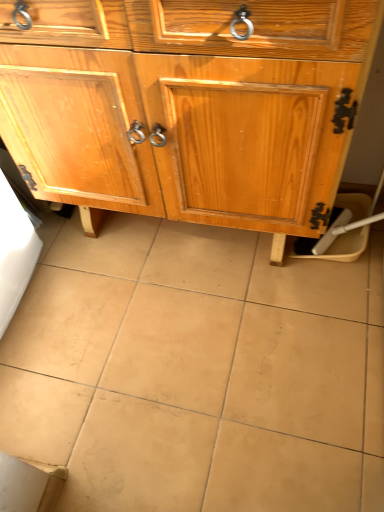
Locate an element on the screen. vacant region below wooden cabinet at center (from a real-world perspective) is located at coordinates (181, 239).